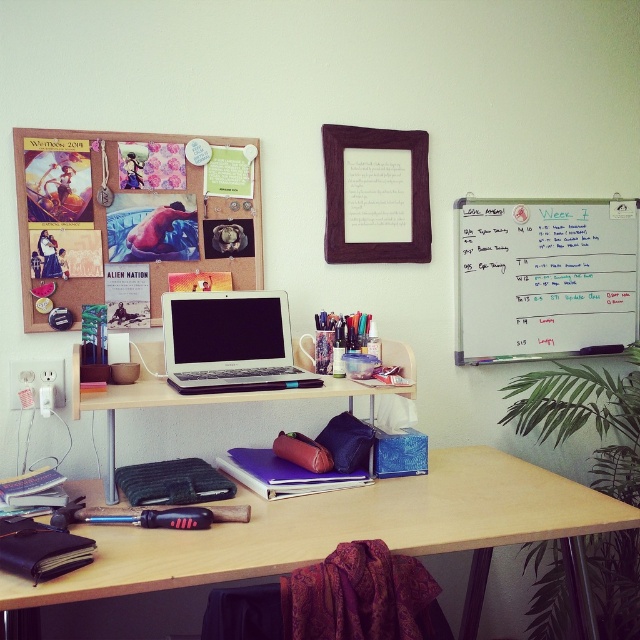
Does wooden desk at center have a lesser height compared to matte black laptop at center?

Indeed, wooden desk at center has a lesser height compared to matte black laptop at center.

Between wooden desk at center and matte black laptop at center, which one is positioned lower?

wooden desk at center is lower down.

This screenshot has height=640, width=640. I want to click on wooden desk at center, so click(x=349, y=529).

Between wooden desk at center and sleek silver laptop at center, which one has less height?

With less height is sleek silver laptop at center.

Is wooden desk at center positioned in front of sleek silver laptop at center?

Yes, it is in front of sleek silver laptop at center.

Measure the distance between point [141,588] and camera.

Point [141,588] and camera are 4.16 feet apart.

At what (x,y) coordinates should I click in order to perform the action: click on wooden desk at center. Please return your answer as a coordinate pair (x, y). Looking at the image, I should click on (349, 529).

Between point (400, 256) and point (410, 381), which one is positioned behind?

Point (400, 256)

Does purple fabric picture frame at upper center appear under matte black laptop at center?

No.

Measure the distance between point (396, 250) and camera.

A distance of 2.25 meters exists between point (396, 250) and camera.

This screenshot has height=640, width=640. Identify the location of purple fabric picture frame at upper center. (376, 195).